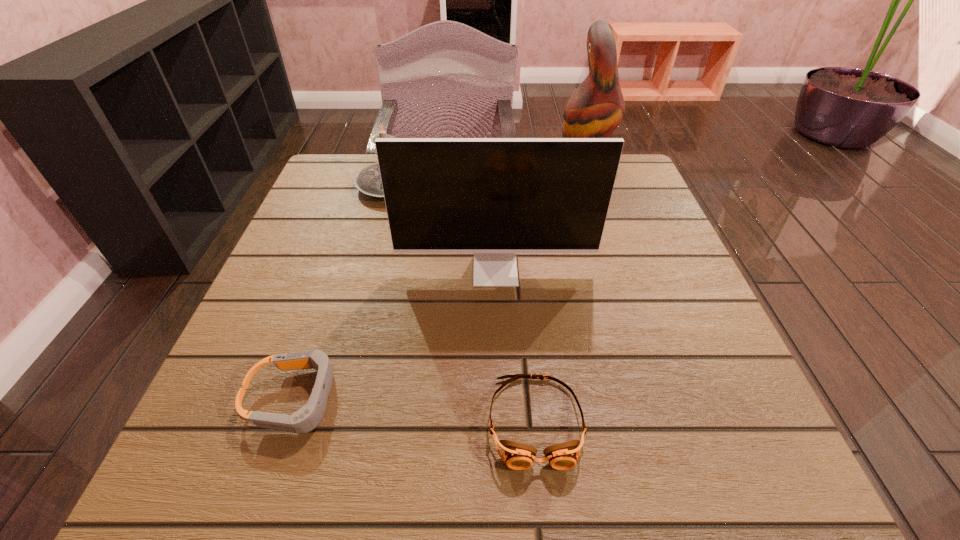
I want to click on vacant space at the far edge of the desktop, so click(382, 204).

This screenshot has width=960, height=540. Identify the location of free space at the near edge. (327, 457).

The width and height of the screenshot is (960, 540). In the image, there is a desktop. In order to click on vacant space at the left edge in this screenshot , I will do `click(321, 272)`.

Where is `free space at the right edge`? Image resolution: width=960 pixels, height=540 pixels. free space at the right edge is located at coordinates (660, 386).

This screenshot has width=960, height=540. In order to click on vacant area at the far left corner in this screenshot , I will do `click(339, 173)`.

The width and height of the screenshot is (960, 540). In the image, there is a desktop. What are the coordinates of `vacant space at the far right corner` in the screenshot? It's located at (617, 185).

Find the location of `vacant region between the tallest object and the left goggles`. vacant region between the tallest object and the left goggles is located at coordinates (441, 284).

Identify the location of free area in between the left goggles and the third nearest object. This screenshot has width=960, height=540. (396, 334).

Where is `free spot between the parrot and the left goggles`? free spot between the parrot and the left goggles is located at coordinates (441, 284).

Identify the location of unoccupied area between the right goggles and the third farthest object. (516, 346).